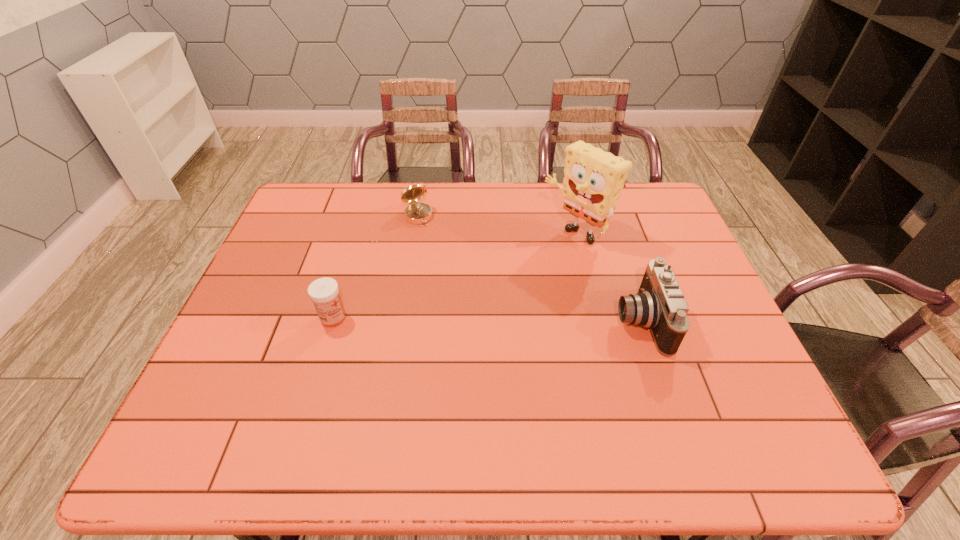
I want to click on the leftmost object, so click(x=324, y=292).

This screenshot has height=540, width=960. Identify the location of the second tallest object. (659, 305).

Locate an element on the screen. The image size is (960, 540). compass is located at coordinates (415, 213).

The width and height of the screenshot is (960, 540). What are the coordinates of `sponge` in the screenshot? It's located at (593, 179).

Identify the location of free spot located on the right of the leftmost object. The width and height of the screenshot is (960, 540). (448, 318).

This screenshot has width=960, height=540. I want to click on free space located 0.340m on the front-facing side of the camera, so click(x=483, y=321).

At what (x,y) coordinates should I click in order to perform the action: click on vacant region located on the front-facing side of the camera. Please return your answer as a coordinate pair (x, y). The height and width of the screenshot is (540, 960). Looking at the image, I should click on (539, 321).

Where is `free point located on the front-facing side of the camera`? free point located on the front-facing side of the camera is located at coordinates (491, 321).

Image resolution: width=960 pixels, height=540 pixels. Identify the location of blank area located 0.080m with the dial facing the compass. (431, 241).

Where is `free space located 0.290m with the dial facing the compass`? The width and height of the screenshot is (960, 540). free space located 0.290m with the dial facing the compass is located at coordinates [x=458, y=286].